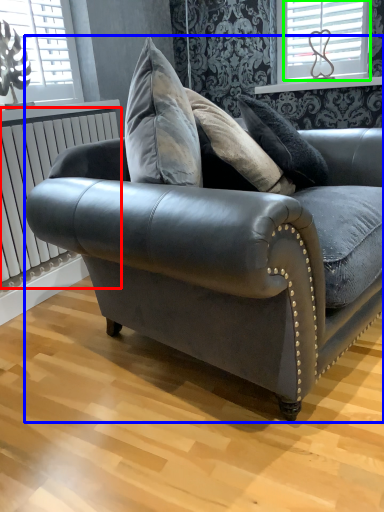
Question: Which is farther away from radiator (highlighted by a red box)? studio couch (highlighted by a blue box) or window (highlighted by a green box)?

Choices:
 (A) studio couch
 (B) window

Answer: (B)